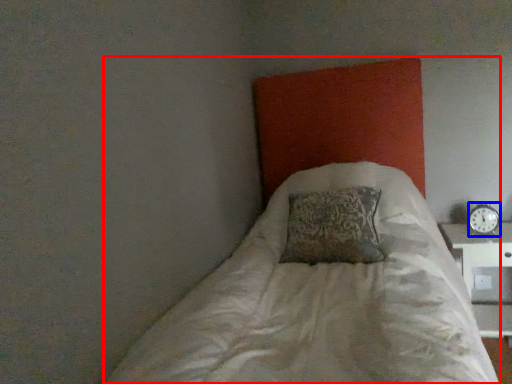
Question: Which of the following is the farthest to the observer, bed (highlighted by a red box) or clock (highlighted by a blue box)?

Choices:
 (A) bed
 (B) clock

Answer: (B)